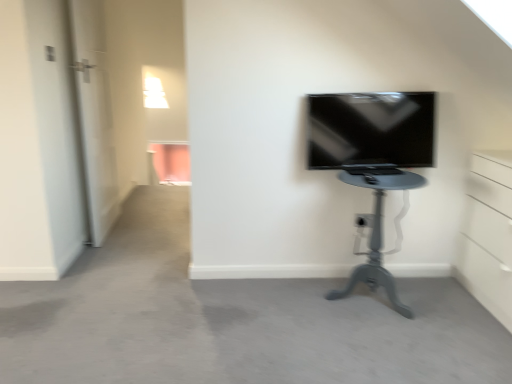
Question: Considering the positions of black glossy tv at upper right and matte gray table at center in the image, is black glossy tv at upper right wider or thinner than matte gray table at center?

Choices:
 (A) wide
 (B) thin

Answer: (B)

Question: In terms of size, does black glossy tv at upper right appear bigger or smaller than matte gray table at center?

Choices:
 (A) big
 (B) small

Answer: (B)

Question: Is black glossy tv at upper right taller or shorter than matte gray table at center?

Choices:
 (A) tall
 (B) short

Answer: (B)

Question: From the image's perspective, is matte gray table at center located above or below black glossy tv at upper right?

Choices:
 (A) below
 (B) above

Answer: (A)

Question: From a real-world perspective, is matte gray table at center positioned above or below black glossy tv at upper right?

Choices:
 (A) below
 (B) above

Answer: (A)

Question: Relative to black glossy tv at upper right, is matte gray table at center in front or behind?

Choices:
 (A) behind
 (B) front

Answer: (B)

Question: Does point (384, 276) appear closer or farther from the camera than point (339, 115)?

Choices:
 (A) farther
 (B) closer

Answer: (B)